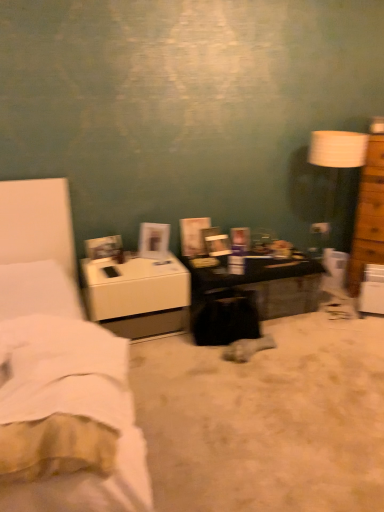
This screenshot has height=512, width=384. I want to click on vacant region in front of black fabric swivel chair at center, so click(x=229, y=375).